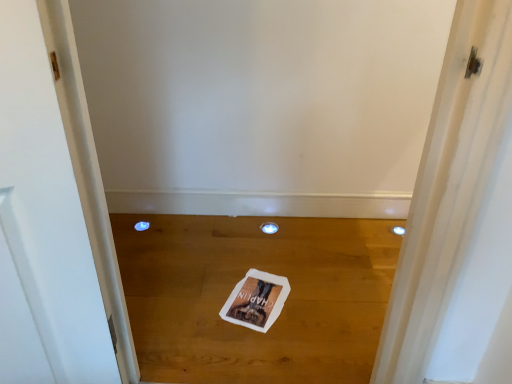
Question: Is blue plastic hole at lower left, the first hole viewed from the left, in front of transparent plastic hole at center, which is the 2th hole from left to right?

Choices:
 (A) yes
 (B) no

Answer: (B)

Question: From a real-world perspective, is blue plastic hole at lower left, the first hole viewed from the left, positioned over transparent plastic hole at center, which is the 2th hole from left to right, based on gravity?

Choices:
 (A) no
 (B) yes

Answer: (A)

Question: Could you tell me if blue plastic hole at lower left, the first hole viewed from the left, is facing transparent plastic hole at center, which is the 2th hole from left to right?

Choices:
 (A) no
 (B) yes

Answer: (A)

Question: Is blue plastic hole at lower left, the second hole when ordered from right to left, taller than transparent plastic hole at center, which is the 2th hole from left to right?

Choices:
 (A) yes
 (B) no

Answer: (B)

Question: Does blue plastic hole at lower left, the second hole when ordered from right to left, have a lesser width compared to transparent plastic hole at center, acting as the first hole starting from the right?

Choices:
 (A) yes
 (B) no

Answer: (A)

Question: Does blue plastic hole at lower left, the second hole when ordered from right to left, have a smaller size compared to transparent plastic hole at center, acting as the first hole starting from the right?

Choices:
 (A) yes
 (B) no

Answer: (A)

Question: Is transparent plastic hole at center, which is the 2th hole from left to right, to the right of white paper magazine at center from the viewer's perspective?

Choices:
 (A) yes
 (B) no

Answer: (A)

Question: Considering the relative positions of transparent plastic hole at center, which is the 2th hole from left to right, and white paper magazine at center in the image provided, is transparent plastic hole at center, which is the 2th hole from left to right, to the left of white paper magazine at center from the viewer's perspective?

Choices:
 (A) no
 (B) yes

Answer: (A)

Question: Is transparent plastic hole at center, which is the 2th hole from left to right, thinner than white paper magazine at center?

Choices:
 (A) yes
 (B) no

Answer: (A)

Question: Considering the relative sizes of transparent plastic hole at center, acting as the first hole starting from the right, and white paper magazine at center in the image provided, is transparent plastic hole at center, acting as the first hole starting from the right, shorter than white paper magazine at center?

Choices:
 (A) no
 (B) yes

Answer: (A)

Question: Is transparent plastic hole at center, acting as the first hole starting from the right, located outside white paper magazine at center?

Choices:
 (A) yes
 (B) no

Answer: (A)

Question: Can you see transparent plastic hole at center, acting as the first hole starting from the right, touching white paper magazine at center?

Choices:
 (A) no
 (B) yes

Answer: (A)

Question: Would you say white paper magazine at center is a long distance from blue plastic hole at lower left, the first hole viewed from the left?

Choices:
 (A) no
 (B) yes

Answer: (A)